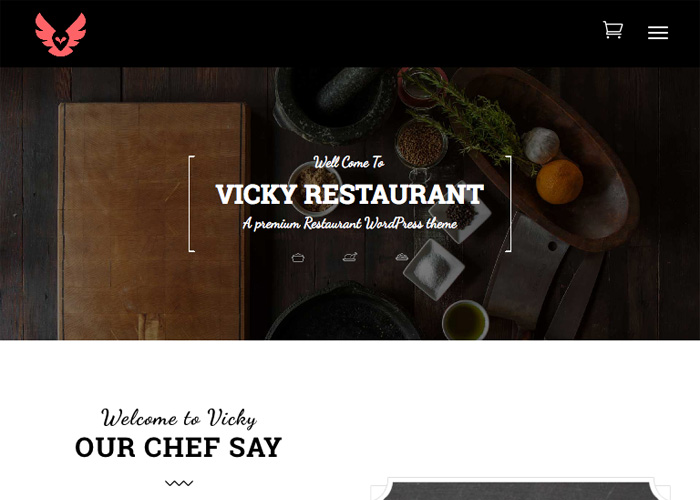
Find the location of a particular element. wooden cutting board is located at coordinates (136, 203).